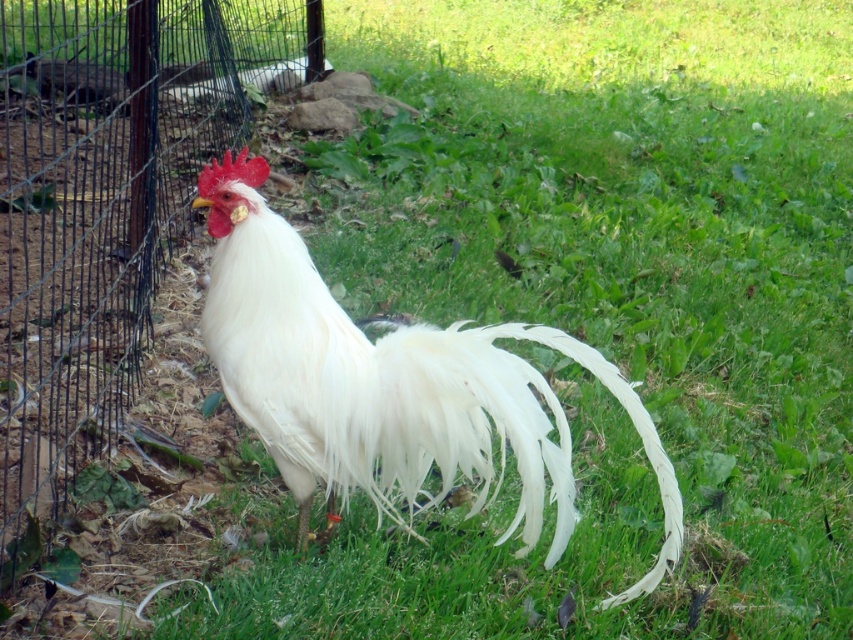
You are a farmer checking the perimeter of your farm. You see the wire mesh fence at left and the white feathered rooster at center. Which object is positioned to the left of the other?

The wire mesh fence at left is to the left of the white feathered rooster at center.

You are a farmer checking the boundaries of your property. You notice the wire mesh fence at left and the white feathered rooster at center. Which object is wider?

The wire mesh fence at left is wider than the white feathered rooster at center.

You are a farmer who needs to check the distance between the wire mesh fence at left and the white feathered rooster at center. Can you confirm if the distance is more than 4 feet?

The wire mesh fence at left is 4.65 feet away from the white feathered rooster at center, so yes, the distance is more than 4 feet.